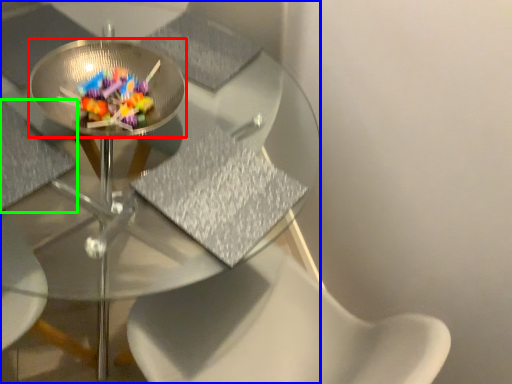
Question: Based on their relative distances, which object is nearer to glass plate (highlighted by a red box)? Choose from table (highlighted by a blue box) and chair (highlighted by a green box).

Choices:
 (A) table
 (B) chair

Answer: (B)